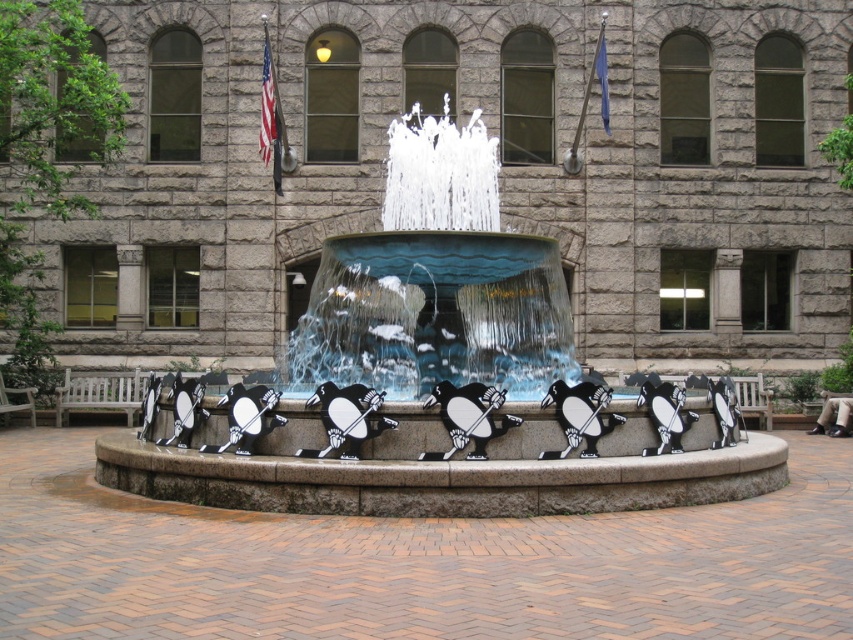
Is white glossy water at center above blue glass water at center?

No.

Which is behind, point (709, 397) or point (515, 241)?

Positioned behind is point (515, 241).

The height and width of the screenshot is (640, 853). I want to click on white glossy water at center, so click(x=440, y=381).